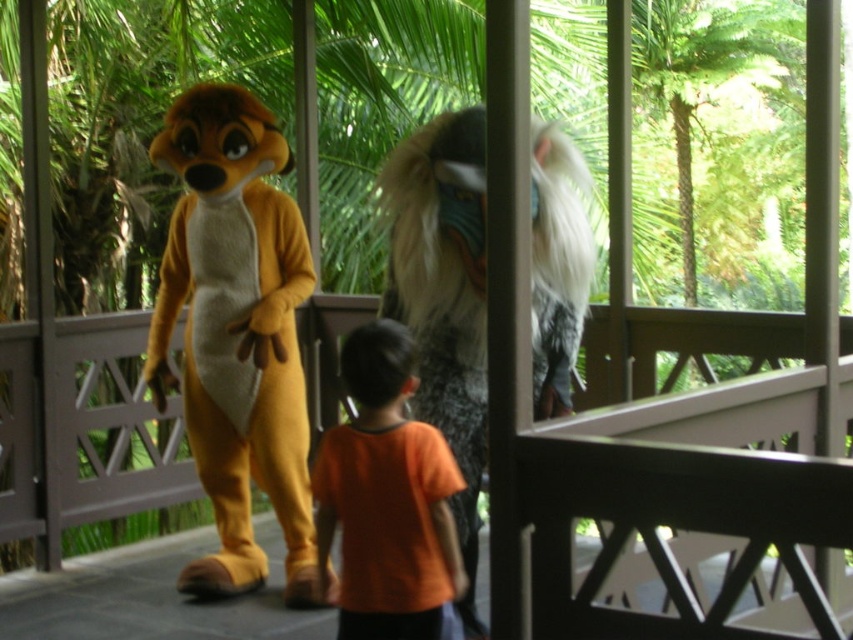
You are standing at the point marked as point (294,579) in the image. The distance from you to the viewer is 4.25 meters. If you want to move closer to the viewer by 2 meters, how far will you be from the viewer then?

After moving closer by 2 meters, the distance from the viewer would be 4.25 meters minus 2 meters, resulting in 2.25 meters.

You are a photographer trying to capture a photo of the orange plush mascot at left and the fuzzy gray fur at center. Based on their positions, which one would appear larger in the photo?

The orange plush mascot at left appears larger in the photo because it is positioned above the fuzzy gray fur at center, which typically means it is closer to the camera and thus larger in the frame.

Consider the image. You are standing on a porch surrounded by tropical plants and see two costumed characters. One is a lemur in orange and the other is a wolf with a white mane. The lemur is at point (225, 426) and the wolf is at point (463, 522). Which character is closer to you?

The lemur at point (225, 426) is closer to you because it is further to the camera than the wolf at point (463, 522).